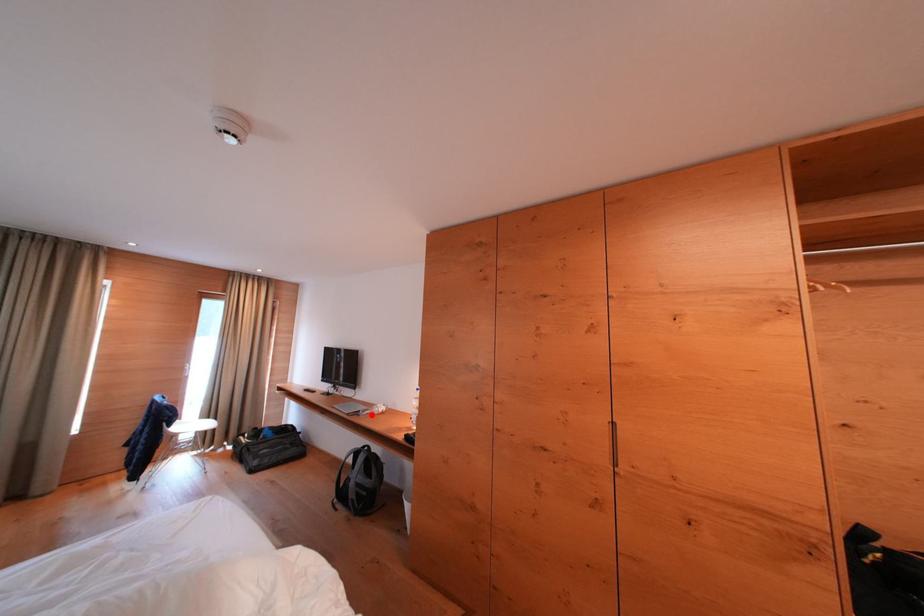
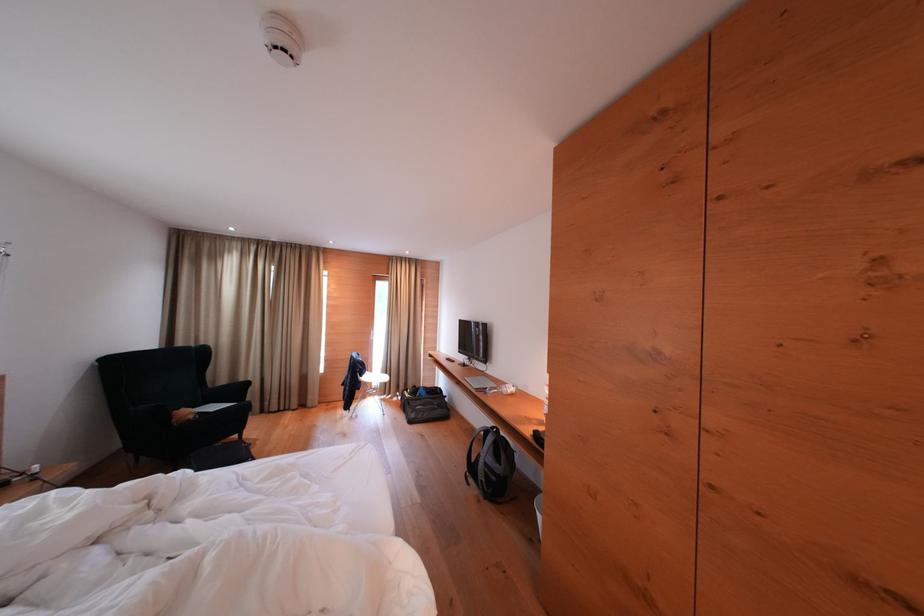
Where in the second image is the point corresponding to the highlighted location from the first image?

(499, 392)